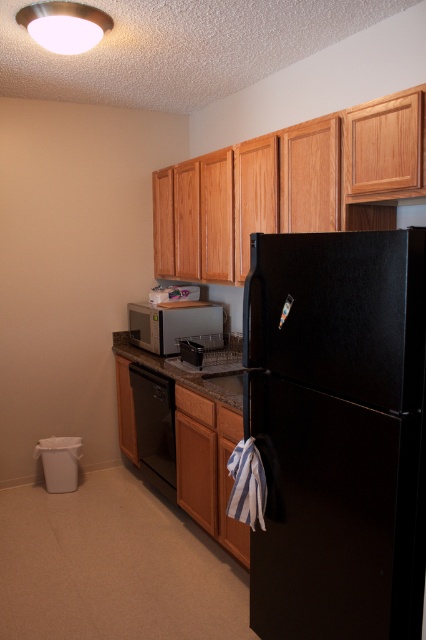
Question: Among these points, which one is farthest from the camera?

Choices:
 (A) (250, 356)
 (B) (238, 390)

Answer: (B)

Question: Can you confirm if black matte refrigerator at center is positioned to the left of granite/black at center?

Choices:
 (A) yes
 (B) no

Answer: (B)

Question: Which point is closer to the camera taking this photo?

Choices:
 (A) (184, 380)
 (B) (170, 339)
 (C) (296, 316)
 (D) (166, 472)

Answer: (C)

Question: Is black matte refrigerator at center below satin silver microwave at center?

Choices:
 (A) no
 (B) yes

Answer: (B)

Question: Which of these objects is positioned closest to the granite/black at center?

Choices:
 (A) black matte dishwasher at lower center
 (B) black matte refrigerator at center

Answer: (A)

Question: Considering the relative positions of black matte refrigerator at center and black matte dishwasher at lower center in the image provided, where is black matte refrigerator at center located with respect to black matte dishwasher at lower center?

Choices:
 (A) above
 (B) below

Answer: (A)